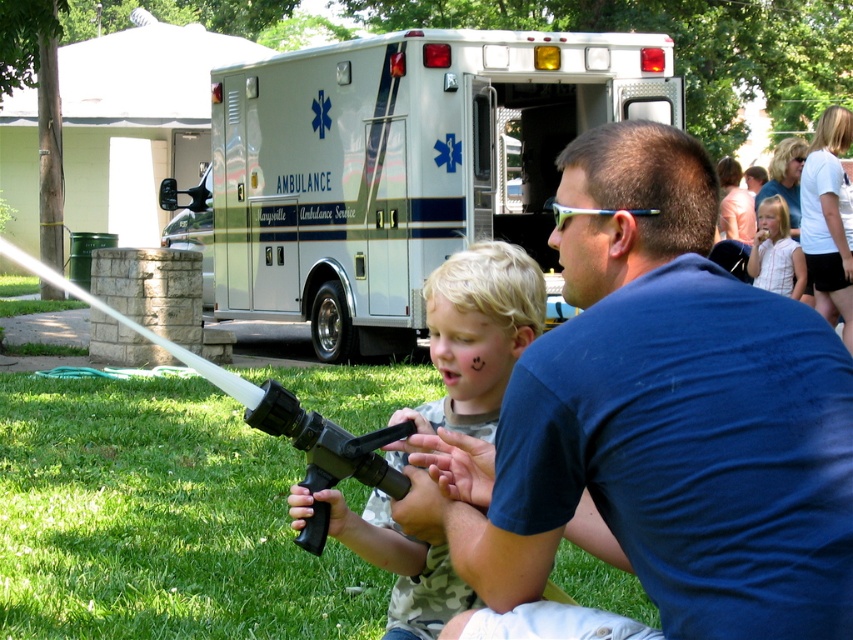
Identify the location of camouflage-patterned shirt at center. (477, 333).

Is camouflage-patterned shirt at center bigger than white striped shirt at upper right?

Actually, camouflage-patterned shirt at center might be smaller than white striped shirt at upper right.

This screenshot has height=640, width=853. I want to click on camouflage-patterned shirt at center, so click(x=477, y=333).

Can you confirm if white glossy ambulance at center is wider than white striped shirt at upper right?

Indeed, white glossy ambulance at center has a greater width compared to white striped shirt at upper right.

Who is positioned more to the left, white glossy ambulance at center or white striped shirt at upper right?

white glossy ambulance at center is more to the left.

Is point (235, 99) behind point (779, 224)?

That is True.

Locate an element on the screen. This screenshot has width=853, height=640. white glossy ambulance at center is located at coordinates point(398,166).

Is camouflage-patterned shirt at center positioned in front of black plastic hose at lower center?

That is False.

Measure the distance between camouflage-patterned shirt at center and camera.

The distance of camouflage-patterned shirt at center from camera is 2.45 meters.

The width and height of the screenshot is (853, 640). I want to click on camouflage-patterned shirt at center, so click(x=477, y=333).